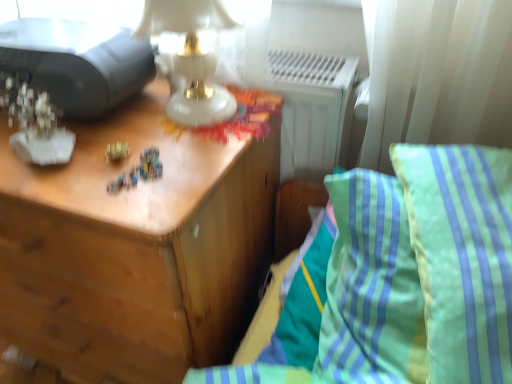
Question: Which is correct: green striped pillow at right is inside wooden nightstand at left, or outside of it?

Choices:
 (A) outside
 (B) inside

Answer: (A)

Question: In terms of height, does green striped pillow at right look taller or shorter compared to wooden nightstand at left?

Choices:
 (A) tall
 (B) short

Answer: (B)

Question: Which object is the closest to the green striped pillow at right?

Choices:
 (A) wooden nightstand at left
 (B) gold metallic toy at center
 (C) green striped pillow at right
 (D) matte black printer at upper left

Answer: (C)

Question: Estimate the real-world distances between objects in this image. Which object is closer to the gold metallic toy at center?

Choices:
 (A) wooden nightstand at left
 (B) green striped pillow at right
 (C) matte black printer at upper left
 (D) green striped pillow at right

Answer: (C)